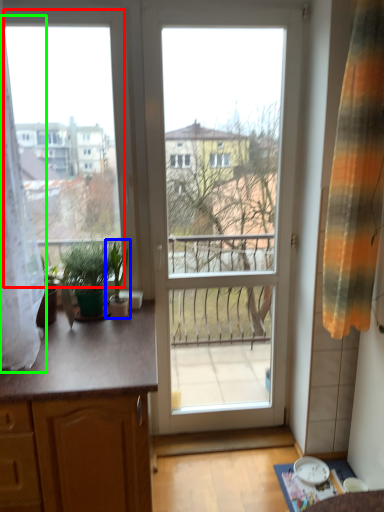
Question: Which is farther away from window screen (highlighted by a red box)? houseplant (highlighted by a blue box) or curtain (highlighted by a green box)?

Choices:
 (A) houseplant
 (B) curtain

Answer: (A)